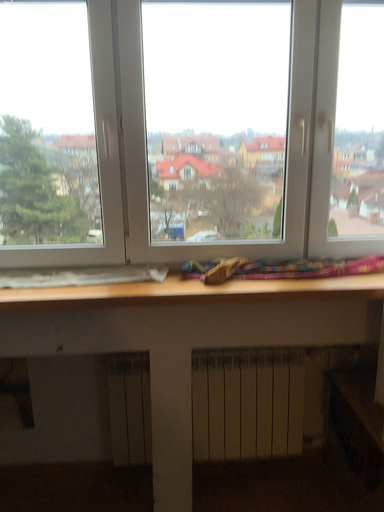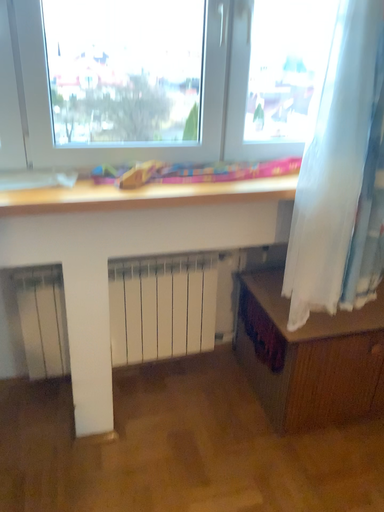
Question: How did the camera likely rotate when shooting the video?

Choices:
 (A) rotated downward
 (B) rotated upward

Answer: (A)